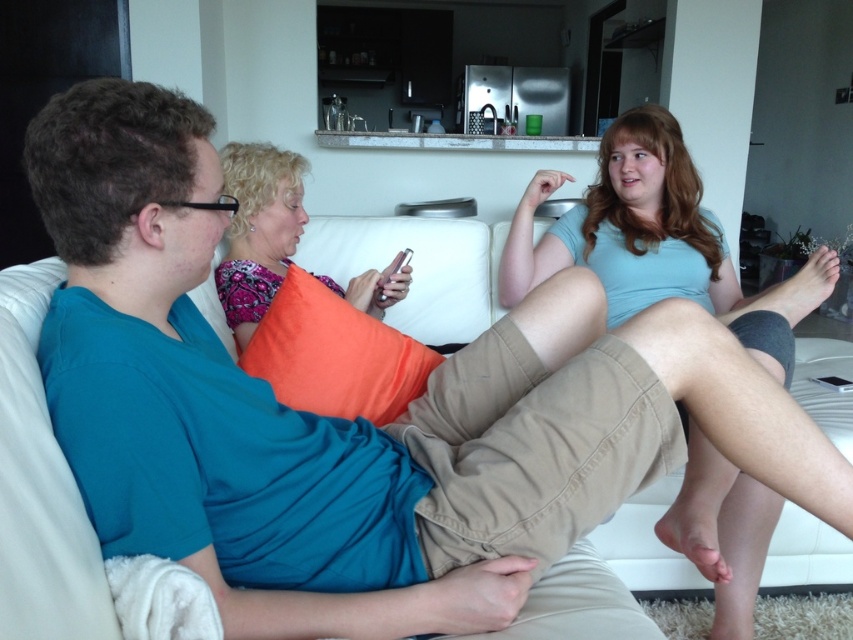
Does matte blue shirt at upper right have a lesser width compared to patterned fabric pillow at center?

No.

Is matte blue shirt at upper right wider than patterned fabric pillow at center?

Indeed, matte blue shirt at upper right has a greater width compared to patterned fabric pillow at center.

Does point (715, 476) come in front of point (299, 212)?

Yes, it is.

Image resolution: width=853 pixels, height=640 pixels. I want to click on matte blue shirt at upper right, so click(x=657, y=243).